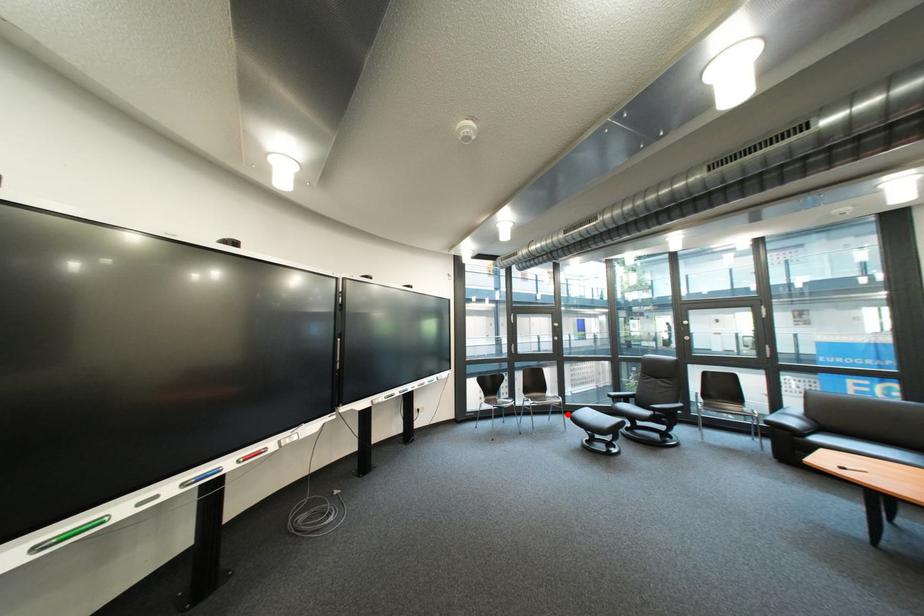
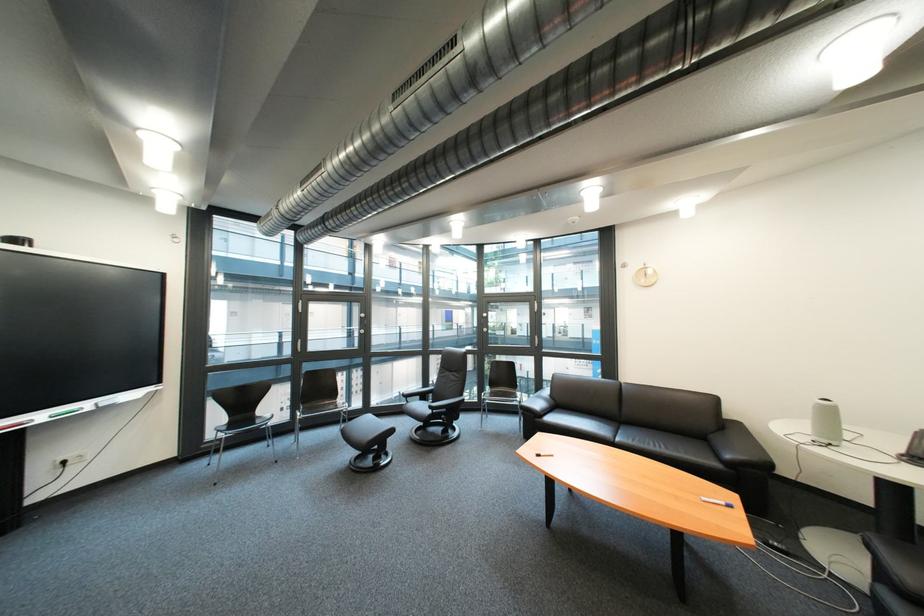
Question: I am providing you with two images of the same scene from different viewpoints. Image1 has a red point marked. In image2, the corresponding 3D location appears at what relative position? Reply with the corresponding letter.

Choices:
 (A) Closer
 (B) Farther

Answer: (A)